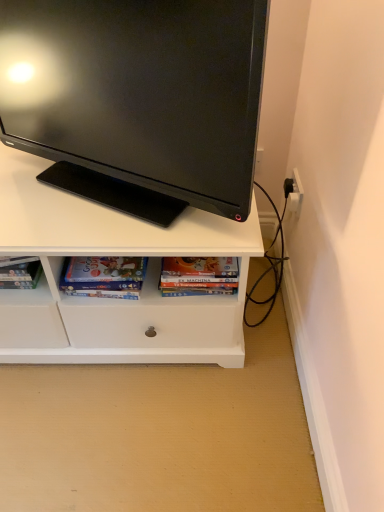
Question: Which direction should I rotate to look at hardcover book at center, acting as the 1th book starting from the right?

Choices:
 (A) left
 (B) right

Answer: (B)

Question: Is matte black monitor at upper center at the right side of matte cardboard book at lower center, which is the second book from right to left?

Choices:
 (A) no
 (B) yes

Answer: (B)

Question: Is the position of matte black monitor at upper center less distant than that of matte cardboard book at lower center, the first book from the left?

Choices:
 (A) yes
 (B) no

Answer: (A)

Question: Considering the relative sizes of matte black monitor at upper center and matte cardboard book at lower center, the first book from the left, in the image provided, is matte black monitor at upper center thinner than matte cardboard book at lower center, the first book from the left,?

Choices:
 (A) yes
 (B) no

Answer: (B)

Question: Can we say matte black monitor at upper center lies outside matte cardboard book at lower center, the first book from the left?

Choices:
 (A) yes
 (B) no

Answer: (A)

Question: Can you confirm if matte black monitor at upper center is bigger than matte cardboard book at lower center, the first book from the left?

Choices:
 (A) no
 (B) yes

Answer: (B)

Question: Considering the relative sizes of matte black monitor at upper center and matte cardboard book at lower center, the first book from the left, in the image provided, is matte black monitor at upper center wider than matte cardboard book at lower center, the first book from the left,?

Choices:
 (A) yes
 (B) no

Answer: (A)

Question: From a real-world perspective, is hardcover book at center, the second book positioned from the left, located beneath matte black monitor at upper center?

Choices:
 (A) no
 (B) yes

Answer: (B)

Question: Is hardcover book at center, acting as the 1th book starting from the right, not inside matte black monitor at upper center?

Choices:
 (A) no
 (B) yes

Answer: (B)

Question: Is matte black monitor at upper center completely or partially inside hardcover book at center, acting as the 1th book starting from the right?

Choices:
 (A) yes
 (B) no

Answer: (B)

Question: Could you tell me if hardcover book at center, acting as the 1th book starting from the right, is turned towards matte black monitor at upper center?

Choices:
 (A) yes
 (B) no

Answer: (B)

Question: Is hardcover book at center, acting as the 1th book starting from the right, at the left side of matte black monitor at upper center?

Choices:
 (A) no
 (B) yes

Answer: (A)

Question: From the image's perspective, is hardcover book at center, the second book positioned from the left, located above matte black monitor at upper center?

Choices:
 (A) no
 (B) yes

Answer: (A)

Question: From a real-world perspective, is matte black monitor at upper center located beneath hardcover book at center, acting as the 1th book starting from the right?

Choices:
 (A) no
 (B) yes

Answer: (A)